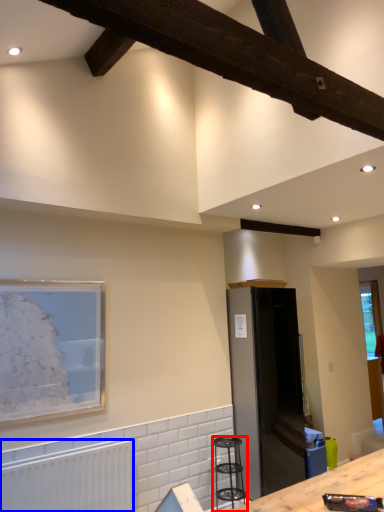
Question: Which point is closer to the camera, bar stool (highlighted by a red box) or radiator (highlighted by a blue box)?

Choices:
 (A) bar stool
 (B) radiator

Answer: (B)